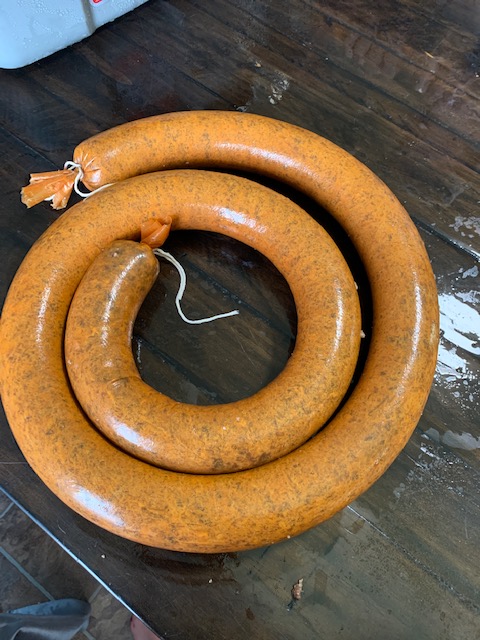
I want to click on crumb, so click(297, 593).